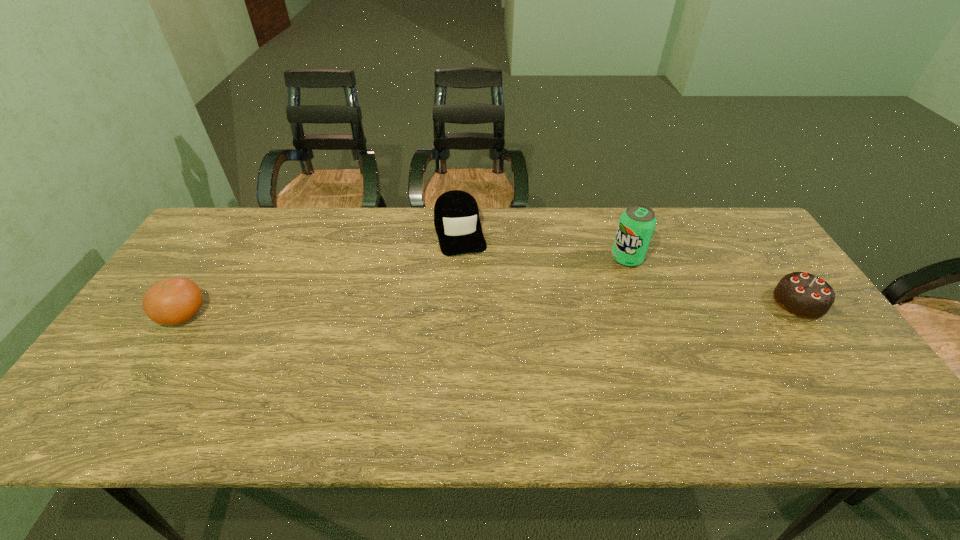
You are a GUI agent. You are given a task and a screenshot of the screen. Output one action in this format:
    pyautogui.click(x=<x>, y=<y>)
    Task: Click on the free space on the desktop that is between the leftmost object and the chocolate cake and is positioned on the front-facing side of the cap
    Image resolution: width=960 pixels, height=540 pixels.
    Given the screenshot: What is the action you would take?
    pyautogui.click(x=480, y=308)

This screenshot has height=540, width=960. Find the location of `free spot on the desktop that is between the leftmost object and the rightmost object and is positioned on the front-facing side of the tallest object`. free spot on the desktop that is between the leftmost object and the rightmost object and is positioned on the front-facing side of the tallest object is located at coordinates [x=583, y=306].